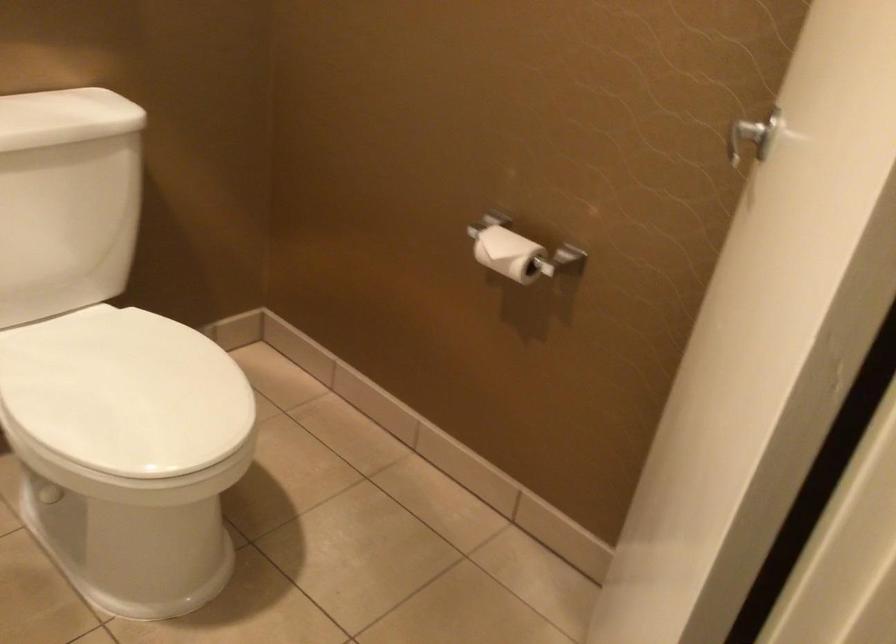
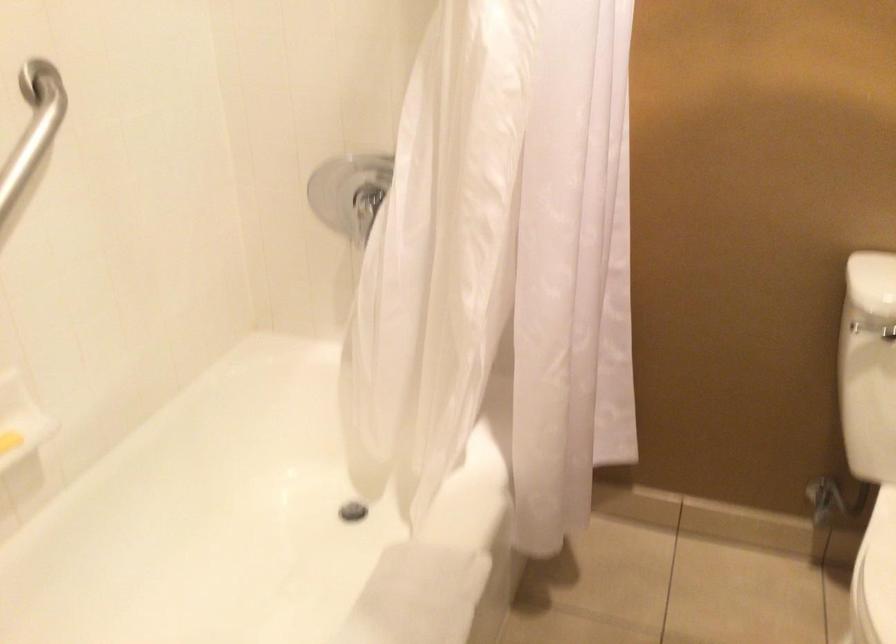
Question: How did the camera likely rotate?

Choices:
 (A) Left
 (B) Right
 (C) Up
 (D) Down

Answer: (A)